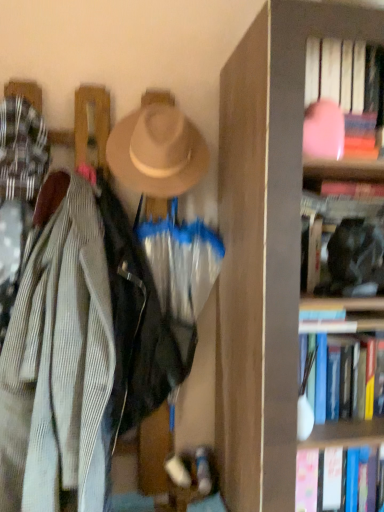
Question: From a real-world perspective, is pink matte book at upper right, the first book in the top-to-bottom sequence, on black matte bookshelf at upper right, the second book when ordered from bottom to top?

Choices:
 (A) yes
 (B) no

Answer: (A)

Question: Is pink matte book at upper right, which ranks as the third book in bottom-to-top order, located outside black matte bookshelf at upper right, the second book when ordered from bottom to top?

Choices:
 (A) yes
 (B) no

Answer: (A)

Question: From the image's perspective, is pink matte book at upper right, the first book in the top-to-bottom sequence, beneath black matte bookshelf at upper right, the second book when ordered from bottom to top?

Choices:
 (A) no
 (B) yes

Answer: (A)

Question: Is pink matte book at upper right, the first book in the top-to-bottom sequence, positioned with its back to black matte bookshelf at upper right, the 2th book from the top?

Choices:
 (A) no
 (B) yes

Answer: (A)

Question: Does pink matte book at upper right, which ranks as the third book in bottom-to-top order, have a greater width compared to black matte bookshelf at upper right, the second book when ordered from bottom to top?

Choices:
 (A) yes
 (B) no

Answer: (A)

Question: From the image's perspective, is black matte bookshelf at upper right, the second book when ordered from bottom to top, located above or below beige felt hat at upper center?

Choices:
 (A) below
 (B) above

Answer: (A)

Question: In terms of width, does black matte bookshelf at upper right, the second book when ordered from bottom to top, look wider or thinner when compared to beige felt hat at upper center?

Choices:
 (A) wide
 (B) thin

Answer: (B)

Question: Considering the positions of point (336, 276) and point (170, 193), is point (336, 276) closer or farther from the camera than point (170, 193)?

Choices:
 (A) farther
 (B) closer

Answer: (B)

Question: Would you say black matte bookshelf at upper right, the 2th book from the top, is to the left or to the right of beige felt hat at upper center in the picture?

Choices:
 (A) left
 (B) right

Answer: (B)

Question: Based on their sizes in the image, would you say hardcover book at right, which is the 1th book in bottom-to-top order, is bigger or smaller than beige felt hat at upper center?

Choices:
 (A) big
 (B) small

Answer: (B)

Question: Is point click(370, 414) positioned closer to the camera than point click(203, 162)?

Choices:
 (A) closer
 (B) farther

Answer: (A)

Question: Is hardcover book at right, which is the 1th book in bottom-to-top order, situated inside beige felt hat at upper center or outside?

Choices:
 (A) outside
 (B) inside

Answer: (A)

Question: Looking at their shapes, would you say hardcover book at right, which is the 1th book in bottom-to-top order, is wider or thinner than beige felt hat at upper center?

Choices:
 (A) thin
 (B) wide

Answer: (B)

Question: From the image's perspective, is pink matte book at upper right, the first book in the top-to-bottom sequence, located above or below black matte bookshelf at upper right, the 2th book from the top?

Choices:
 (A) above
 (B) below

Answer: (A)

Question: Is pink matte book at upper right, which ranks as the third book in bottom-to-top order, in front of or behind black matte bookshelf at upper right, the second book when ordered from bottom to top, in the image?

Choices:
 (A) behind
 (B) front

Answer: (B)